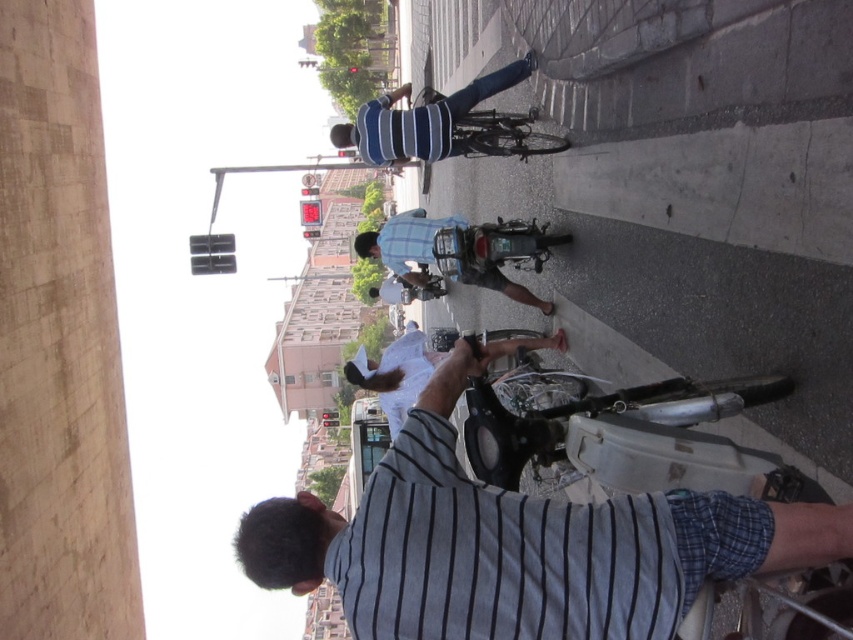
You are a photographer standing at the edge of the street. You want to take a photo that includes both the gray striped shirt at center and the shiny black bicycle at center. Based on their relative sizes in the image, which object should you focus on first to ensure both are in frame?

The gray striped shirt at center is taller than the shiny black bicycle at center. To ensure both are in frame, focus on the taller object first, which is the gray striped shirt at center.

You are a photographer standing at the edge of the street. You want to capture a photo where both the gray striped shirt at center and the shiny black bicycle at center are clearly visible. Based on their sizes, which object should you focus on to ensure both are in frame?

The gray striped shirt at center is larger than the shiny black bicycle at center. To ensure both are in frame, focus on the gray striped shirt at center as it is larger and will be easier to position within the camera view.

You are a photographer trying to capture a photo of the striped fabric shirt at center and the shiny black bicycle at center. If you want to ensure both are fully visible in the frame, which object should you focus on first to avoid cropping either?

You should focus on the striped fabric shirt at center first because its width is larger than the shiny black bicycle at center, so it requires more space in the frame to avoid cropping.